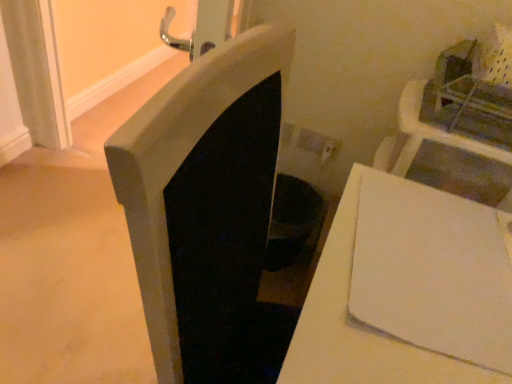
The width and height of the screenshot is (512, 384). What are the coordinates of `free space above white matte table at lower right (from a real-world perspective)` in the screenshot? It's located at (x=435, y=277).